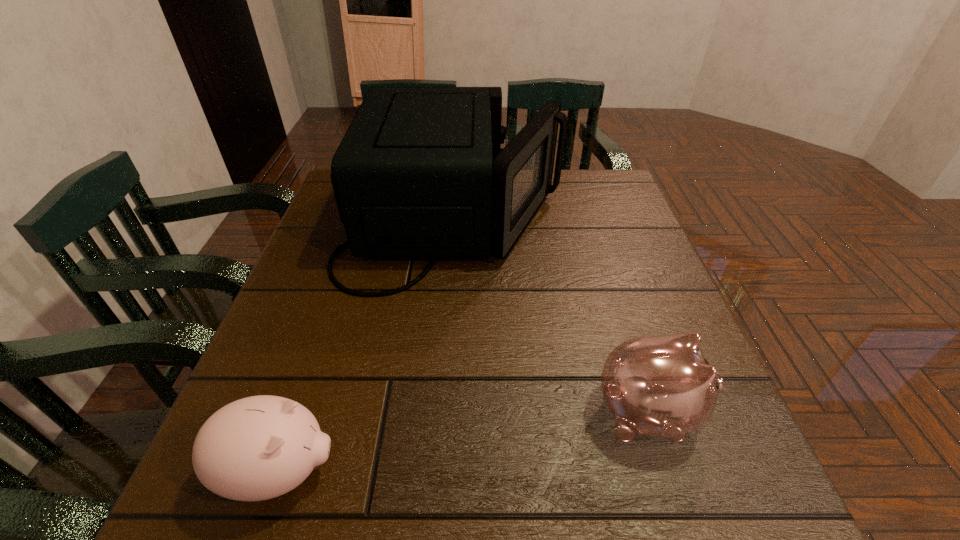
Locate an element on the screen. the farthest object is located at coordinates (420, 172).

Find the location of a particular element. This screenshot has height=540, width=960. the tallest object is located at coordinates (420, 172).

Image resolution: width=960 pixels, height=540 pixels. Identify the location of the right piggy bank. (662, 386).

Locate an element on the screen. This screenshot has height=540, width=960. the left piggy bank is located at coordinates (257, 448).

Locate an element on the screen. The height and width of the screenshot is (540, 960). vacant region located with the door open on the microwave oven is located at coordinates (622, 221).

At what (x,y) coordinates should I click in order to perform the action: click on vacant space located at the snout of the left piggy bank. Please return your answer as a coordinate pair (x, y). The width and height of the screenshot is (960, 540). Looking at the image, I should click on (464, 471).

You are a GUI agent. You are given a task and a screenshot of the screen. Output one action in this format:
    pyautogui.click(x=<x>, y=<y>)
    Task: Click on the object that is at the far edge
    The width and height of the screenshot is (960, 540).
    Given the screenshot: What is the action you would take?
    pyautogui.click(x=420, y=172)

What are the coordinates of `object located at the near edge` in the screenshot? It's located at (257, 448).

This screenshot has height=540, width=960. I want to click on microwave oven that is positioned at the left edge, so click(420, 172).

Image resolution: width=960 pixels, height=540 pixels. In order to click on piggy bank that is at the left edge in this screenshot , I will do `click(257, 448)`.